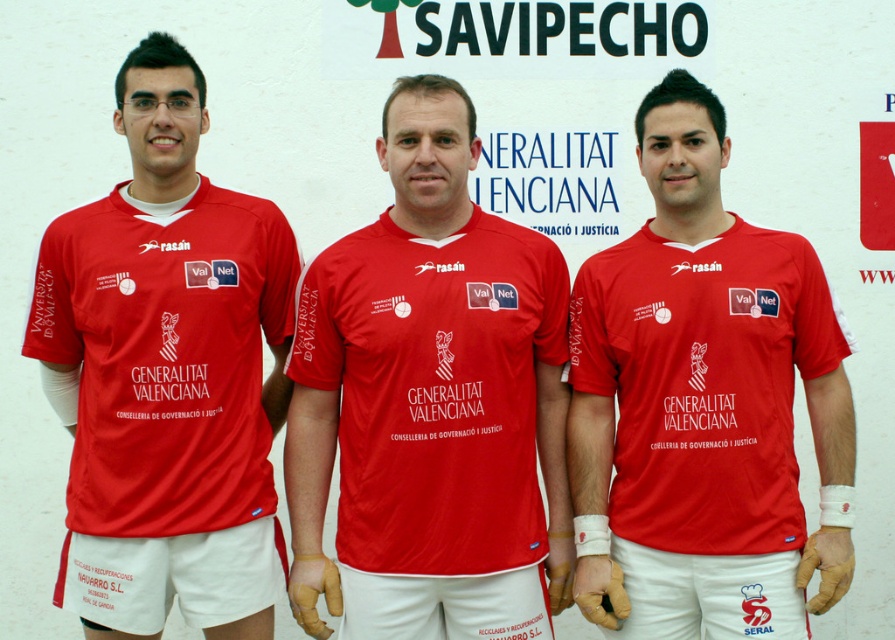
You are a photographer taking a group photo of the three individuals. You need to adjust your camera focus to ensure the matte red shirt at center and the matte red jersey at left are both in focus. Given their positions, which one should you focus on first to ensure both are sharp?

You should focus on the matte red shirt at center first because it is closer to the viewer than the matte red jersey at left. By focusing on the closer object, the depth of field will naturally include the farther one in sharpness.

You are organizing a team photo and need to ensure that the two central team members wearing the matte jersey at center and the matte red shirt at center can stand side by side without overlapping their clothing. Given their positions, will the total width of both items allow them to fit within a 1.5 meter frame?

The matte jersey at center is wider than the matte red shirt at center, but the combined width of both items is not provided. However, since the jersey is larger, it might exceed the 1.5 meter frame when placed side by side. To ensure they fit, check the exact measurements of both garments.